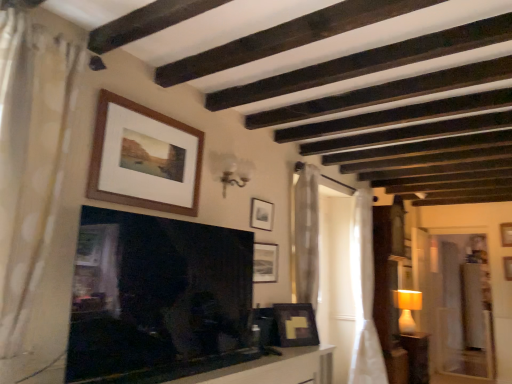
Where is `matte black picture frame at lower right, positioned as the fourth picture frame in left-to-right order`? The image size is (512, 384). matte black picture frame at lower right, positioned as the fourth picture frame in left-to-right order is located at coordinates (295, 324).

In order to face wooden side table at right, should I rotate leftwards or rightwards?

To face it directly, rotate right by 20.071 degrees.

What do you see at coordinates (506, 234) in the screenshot? I see `wooden picture frame at upper center, the 1th picture frame viewed from the back` at bounding box center [506, 234].

Where is `white fabric lampshade at right`? white fabric lampshade at right is located at coordinates (407, 308).

This screenshot has height=384, width=512. Identify the location of white sheer curtain at center, placed as the 2th curtain when sorted from front to back. 348,286.

Is black glossy fireplace at center shorter than matte black picture frame at upper center, which is the third picture frame from right to left?

No.

In order to click on fireplace located on the left of matte black picture frame at upper center, which appears as the 2th picture frame when viewed from the back in this screenshot , I will do `click(157, 299)`.

Between black glossy fireplace at center and matte black picture frame at upper center, which is the 2th picture frame in top-to-bottom order, which one has larger size?

With larger size is black glossy fireplace at center.

Can you tell me how much black glossy fireplace at center and matte black picture frame at upper center, marked as the 3th picture frame in a left-to-right arrangement, differ in facing direction?

The angle between the facing direction of black glossy fireplace at center and the facing direction of matte black picture frame at upper center, marked as the 3th picture frame in a left-to-right arrangement, is 0.26 degrees.

Would you say wooden side table at right is inside or outside white fabric lampshade at right?

wooden side table at right is spatially situated outside white fabric lampshade at right.

Is wooden side table at right wider or thinner than white fabric lampshade at right?

Clearly, wooden side table at right has more width compared to white fabric lampshade at right.

Between point (425, 334) and point (407, 322), which one is positioned in front?

Positioned in front is point (407, 322).

Considering the positions of objects wooden side table at right and white fabric lampshade at right in the image provided, who is more to the left, wooden side table at right or white fabric lampshade at right?

From the viewer's perspective, white fabric lampshade at right appears more on the left side.

Considering their positions, is matte black picture frame at upper center, the 4th picture frame in the back-to-front sequence, located in front of or behind white sheer curtain at center, placed as the 2th curtain when sorted from front to back?

matte black picture frame at upper center, the 4th picture frame in the back-to-front sequence, is in front of white sheer curtain at center, placed as the 2th curtain when sorted from front to back.

Is matte black picture frame at upper center, the second picture frame when ordered from front to back, facing away from white sheer curtain at center, which ranks as the 2th curtain in left-to-right order?

matte black picture frame at upper center, the second picture frame when ordered from front to back, is not turned away from white sheer curtain at center, which ranks as the 2th curtain in left-to-right order.

Considering the sizes of objects matte black picture frame at upper center, the 4th picture frame in the back-to-front sequence, and white sheer curtain at center, the 2th curtain from the back, in the image provided, who is shorter, matte black picture frame at upper center, the 4th picture frame in the back-to-front sequence, or white sheer curtain at center, the 2th curtain from the back,?

matte black picture frame at upper center, the 4th picture frame in the back-to-front sequence.

Are matte black picture frame at upper center, which is the 2th picture frame from left to right, and white sheer curtain at center, the second curtain when ordered from right to left, beside each other?

matte black picture frame at upper center, which is the 2th picture frame from left to right, and white sheer curtain at center, the second curtain when ordered from right to left, are clearly separated.

From the picture: Is wooden picture frame at upper center, placed as the 5th picture frame when sorted from front to back, wider than matte black picture frame at lower right, arranged as the fifth picture frame when viewed from the top?

In fact, wooden picture frame at upper center, placed as the 5th picture frame when sorted from front to back, might be narrower than matte black picture frame at lower right, arranged as the fifth picture frame when viewed from the top.

Is wooden picture frame at upper center, the 2th picture frame in the bottom-to-top sequence, far from matte black picture frame at lower right, placed as the first picture frame when sorted from bottom to top?

wooden picture frame at upper center, the 2th picture frame in the bottom-to-top sequence, is far away from matte black picture frame at lower right, placed as the first picture frame when sorted from bottom to top.

Find the location of a particular element. The width and height of the screenshot is (512, 384). the 1st picture frame above the matte black picture frame at lower right, which appears as the 3th picture frame when viewed from the front (from the image's perspective) is located at coordinates (506, 234).

Based on the photo, which of these two, matte black picture frame at upper center, which is counted as the 4th picture frame, starting from the front, or white fabric lampshade at right, stands taller?

white fabric lampshade at right is taller.

Consider the image. Is matte black picture frame at upper center, which appears as the 2th picture frame when viewed from the back, oriented towards white fabric lampshade at right?

No, matte black picture frame at upper center, which appears as the 2th picture frame when viewed from the back, is not oriented towards white fabric lampshade at right.

I want to click on lamp located underneath the matte black picture frame at upper center, which appears as the 2th picture frame when viewed from the back (from a real-world perspective), so click(407, 308).

Is matte black picture frame at upper center, which appears as the 2th picture frame when viewed from the back, with white fabric lampshade at right?

No, matte black picture frame at upper center, which appears as the 2th picture frame when viewed from the back, is not with white fabric lampshade at right.

Which of these two, wooden picture frame at upper center, placed as the 5th picture frame when sorted from front to back, or white sheer curtain at center, which ranks as the 2th curtain in left-to-right order, is smaller?

With smaller size is wooden picture frame at upper center, placed as the 5th picture frame when sorted from front to back.

Which object is more forward, wooden picture frame at upper center, the 5th picture frame viewed from the left, or white sheer curtain at center, placed as the 2th curtain when sorted from front to back?

white sheer curtain at center, placed as the 2th curtain when sorted from front to back.

You are a GUI agent. You are given a task and a screenshot of the screen. Output one action in this format:
    pyautogui.click(x=<x>, y=<y>)
    Task: Click on the picture frame that is the 4th object above the white sheer curtain at center, placed as the 2th curtain when sorted from front to back (from a real-world perspective)
    Image resolution: width=512 pixels, height=384 pixels.
    Given the screenshot: What is the action you would take?
    pyautogui.click(x=506, y=234)

Can you confirm if wooden picture frame at upper center, the 5th picture frame viewed from the left, is wider than white sheer curtain at center, the 2th curtain from the back?

In fact, wooden picture frame at upper center, the 5th picture frame viewed from the left, might be narrower than white sheer curtain at center, the 2th curtain from the back.

From a real-world perspective, which is physically above, wooden side table at right or matte black picture frame at upper center, marked as the 3th picture frame in a left-to-right arrangement?

From a 3D spatial view, matte black picture frame at upper center, marked as the 3th picture frame in a left-to-right arrangement, is above.

Is point (403, 333) more distant than point (266, 230)?

Yes, point (403, 333) is farther from viewer.

The image size is (512, 384). What are the coordinates of `furniture below the matte black picture frame at upper center, marked as the 3th picture frame in a left-to-right arrangement (from the image's perspective)` in the screenshot? It's located at (416, 356).

In terms of width, does wooden side table at right look wider or thinner when compared to matte black picture frame at upper center, which is counted as the 4th picture frame, starting from the front?

Considering their sizes, wooden side table at right looks broader than matte black picture frame at upper center, which is counted as the 4th picture frame, starting from the front.

Which picture frame is the 2nd one when counting from the right side of the black glossy fireplace at center? Please provide its 2D coordinates.

[(261, 214)]

At what (x,y) coordinates should I click in order to perform the action: click on lamp on the left side of wooden side table at right. Please return your answer as a coordinate pair (x, y). Looking at the image, I should click on (407, 308).

When comparing their distances from white sheer curtain at right, the 1th curtain viewed from the back, does white sheer curtain at center, the 2th curtain from the back, or matte black picture frame at lower right, marked as the third picture frame in a back-to-front arrangement, seem closer?

white sheer curtain at center, the 2th curtain from the back, is positioned closer to the anchor white sheer curtain at right, the 1th curtain viewed from the back.

Considering their positions, is wooden frame at upper center, which appears as the fifth picture frame when viewed from the right, positioned further to white sheer curtain at right, the 3th curtain when ordered from left to right, than white fabric lampshade at right?

Based on the image, wooden frame at upper center, which appears as the fifth picture frame when viewed from the right, appears to be further to white sheer curtain at right, the 3th curtain when ordered from left to right.

When comparing their distances from matte black picture frame at upper center, placed as the third picture frame when sorted from top to bottom, does matte black picture frame at lower right, placed as the first picture frame when sorted from bottom to top, or wooden frame at upper center, the 5th picture frame viewed from the back, seem closer?

matte black picture frame at lower right, placed as the first picture frame when sorted from bottom to top, is positioned closer to the anchor matte black picture frame at upper center, placed as the third picture frame when sorted from top to bottom.

When comparing their distances from smooth white table at lower center, does matte black picture frame at upper center, which appears as the 2th picture frame when viewed from the back, or wooden frame at upper center, the 5th picture frame viewed from the back, seem closer?

matte black picture frame at upper center, which appears as the 2th picture frame when viewed from the back, is positioned closer to the anchor smooth white table at lower center.

When comparing their distances from white dotted fabric curtain at left, placed as the first curtain when sorted from front to back, does black glossy fireplace at center or matte black picture frame at upper center, which is the 2th picture frame in top-to-bottom order, seem further?

Among the two, matte black picture frame at upper center, which is the 2th picture frame in top-to-bottom order, is located further to white dotted fabric curtain at left, placed as the first curtain when sorted from front to back.

Estimate the real-world distances between objects in this image. Which object is further from wooden frame at upper center, positioned as the first picture frame in top-to-bottom order, smooth white table at lower center or white dotted fabric curtain at left, which is counted as the 3th curtain, starting from the back?

smooth white table at lower center is positioned further to the anchor wooden frame at upper center, positioned as the first picture frame in top-to-bottom order.

Which object lies nearer to the anchor point matte black picture frame at upper center, which is counted as the 4th picture frame, starting from the front, white dotted fabric curtain at left, placed as the first curtain when sorted from front to back, or smooth white table at lower center?

smooth white table at lower center is positioned closer to the anchor matte black picture frame at upper center, which is counted as the 4th picture frame, starting from the front.

When comparing their distances from white fabric lampshade at right, does matte black picture frame at lower right, positioned as the fourth picture frame in left-to-right order, or wooden frame at upper center, which appears as the 5th picture frame when ordered from the bottom, seem closer?

The object closer to white fabric lampshade at right is matte black picture frame at lower right, positioned as the fourth picture frame in left-to-right order.

The width and height of the screenshot is (512, 384). I want to click on picture frame between matte black picture frame at upper center, which is the third picture frame from right to left, and white sheer curtain at right, the 1th curtain viewed from the back, so click(295, 324).

You are a GUI agent. You are given a task and a screenshot of the screen. Output one action in this format:
    pyautogui.click(x=<x>, y=<y>)
    Task: Click on the curtain positioned between white sheer curtain at center, the second curtain when ordered from right to left, and white fabric lampshade at right from near to far
    The width and height of the screenshot is (512, 384).
    Given the screenshot: What is the action you would take?
    pyautogui.click(x=364, y=296)

I want to click on curtain between smooth white table at lower center and white sheer curtain at right, the 3th curtain when ordered from left to right, along the z-axis, so click(348, 286).

The height and width of the screenshot is (384, 512). What are the coordinates of `furniture between wooden frame at upper center, which appears as the 5th picture frame when ordered from the bottom, and white fabric lampshade at right from front to back` in the screenshot? It's located at (416, 356).